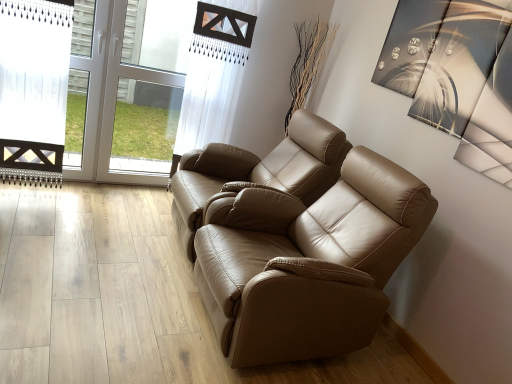
Question: Is tan leather sofa at center, which is the 1th chair from front to back, outside of tan leather sofa at center, arranged as the second chair when viewed from the front?

Choices:
 (A) no
 (B) yes

Answer: (B)

Question: From a real-world perspective, is tan leather sofa at center, which is the second chair in back-to-front order, on top of tan leather sofa at center, arranged as the second chair when viewed from the front?

Choices:
 (A) yes
 (B) no

Answer: (B)

Question: From a real-world perspective, is tan leather sofa at center, which is the second chair in back-to-front order, located beneath tan leather sofa at center, arranged as the second chair when viewed from the front?

Choices:
 (A) no
 (B) yes

Answer: (B)

Question: From the image's perspective, would you say tan leather sofa at center, which is the 1th chair from front to back, is positioned over tan leather sofa at center, arranged as the second chair when viewed from the front?

Choices:
 (A) no
 (B) yes

Answer: (A)

Question: Is tan leather sofa at center, which is the 1th chair from front to back, at the right side of tan leather sofa at center, the first chair when ordered from back to front?

Choices:
 (A) no
 (B) yes

Answer: (B)

Question: From their relative heights in the image, would you say tan leather sofa at center, arranged as the second chair when viewed from the front, is taller or shorter than tan leather sofa at center, which is the second chair in back-to-front order?

Choices:
 (A) short
 (B) tall

Answer: (A)

Question: Is point [288, 148] closer or farther from the camera than point [370, 185]?

Choices:
 (A) closer
 (B) farther

Answer: (B)

Question: Considering the positions of tan leather sofa at center, arranged as the second chair when viewed from the front, and tan leather sofa at center, which is the second chair in back-to-front order, in the image, is tan leather sofa at center, arranged as the second chair when viewed from the front, bigger or smaller than tan leather sofa at center, which is the second chair in back-to-front order,?

Choices:
 (A) big
 (B) small

Answer: (B)

Question: From the image's perspective, relative to tan leather sofa at center, which is the second chair in back-to-front order, is tan leather sofa at center, the first chair when ordered from back to front, above or below?

Choices:
 (A) below
 (B) above

Answer: (B)

Question: Looking at their shapes, would you say tan leather sofa at center, which is the second chair in back-to-front order, is wider or thinner than tan leather sofa at center, the first chair when ordered from back to front?

Choices:
 (A) wide
 (B) thin

Answer: (A)

Question: From a real-world perspective, is tan leather sofa at center, which is the 1th chair from front to back, physically located above or below tan leather sofa at center, arranged as the second chair when viewed from the front?

Choices:
 (A) above
 (B) below

Answer: (B)

Question: Based on their positions, is tan leather sofa at center, which is the 1th chair from front to back, located to the left or right of tan leather sofa at center, the first chair when ordered from back to front?

Choices:
 (A) right
 (B) left

Answer: (A)

Question: Would you say tan leather sofa at center, which is the second chair in back-to-front order, is inside or outside tan leather sofa at center, arranged as the second chair when viewed from the front?

Choices:
 (A) outside
 (B) inside

Answer: (A)

Question: From their relative heights in the image, would you say transparent glass door at upper left is taller or shorter than tan leather sofa at center, the first chair when ordered from back to front?

Choices:
 (A) short
 (B) tall

Answer: (B)

Question: Visually, is transparent glass door at upper left positioned to the left or to the right of tan leather sofa at center, the first chair when ordered from back to front?

Choices:
 (A) left
 (B) right

Answer: (A)